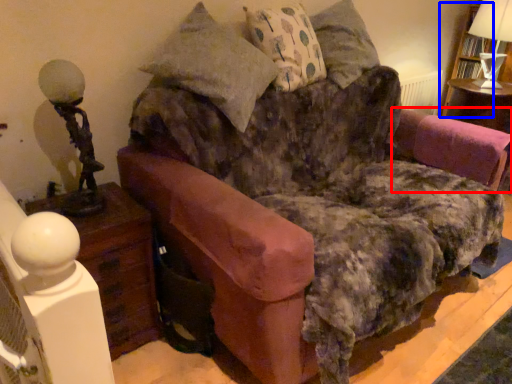
Question: Among these objects, which one is farthest to the camera, swivel chair (highlighted by a red box) or bookshelf (highlighted by a blue box)?

Choices:
 (A) swivel chair
 (B) bookshelf

Answer: (B)